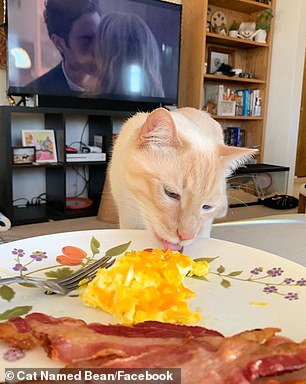
This screenshot has height=384, width=306. Find the location of `tv`. tv is located at coordinates (88, 49).